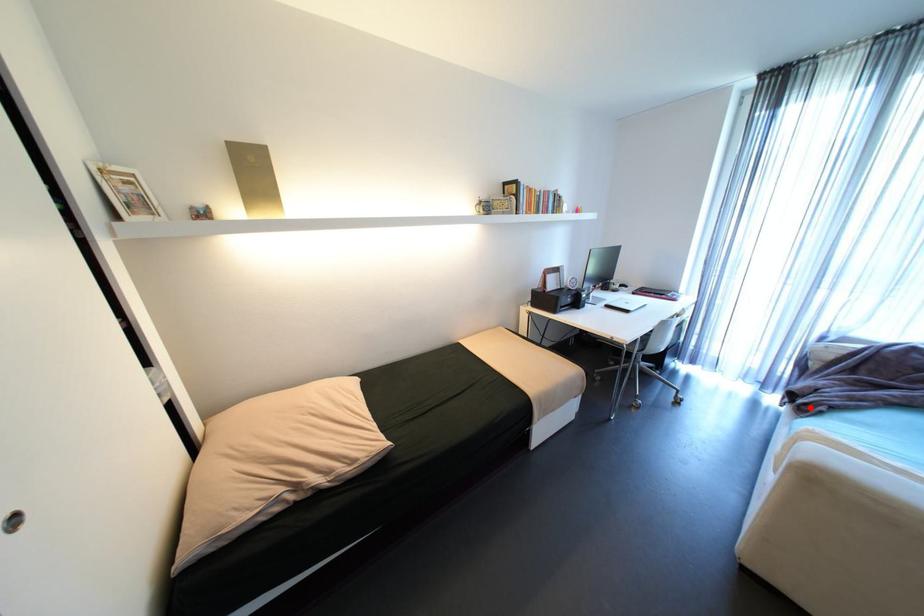
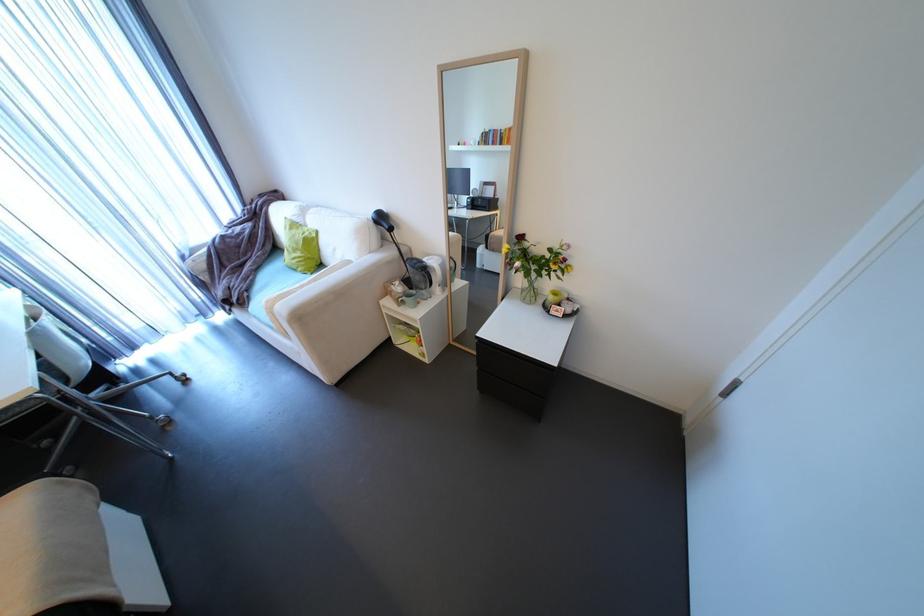
The point at the highlighted location is marked in the first image. Where is the corresponding point in the second image?

(248, 302)